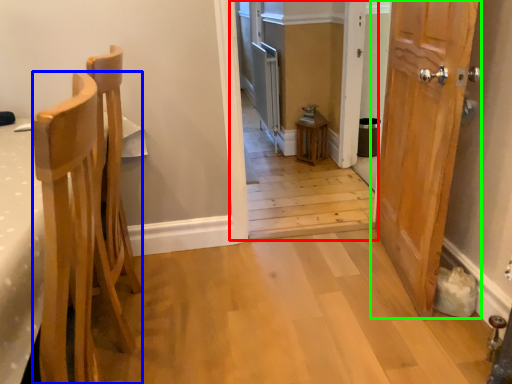
Question: Which object is the farthest from corridor (highlighted by a red box)? Choose among these: chair (highlighted by a blue box) or door (highlighted by a green box).

Choices:
 (A) chair
 (B) door

Answer: (A)